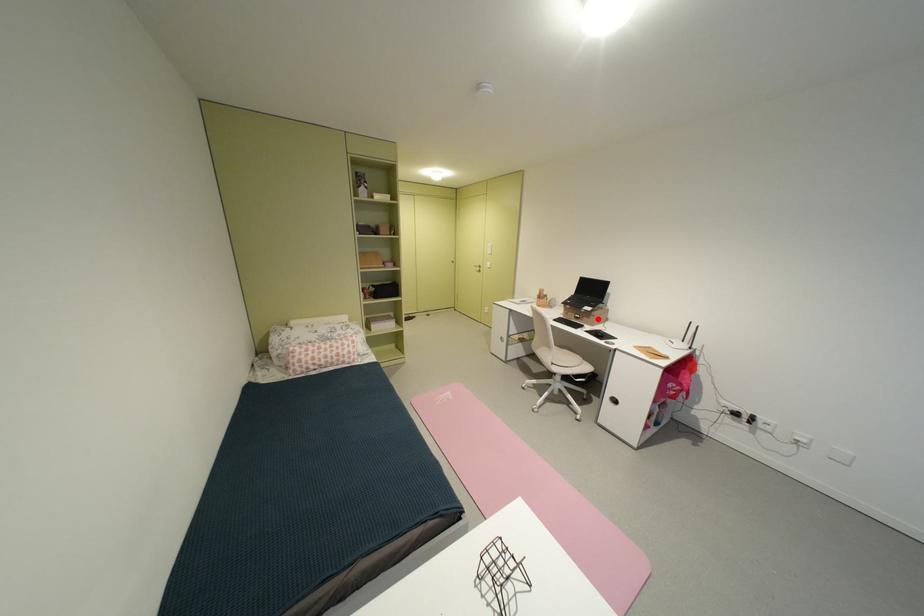
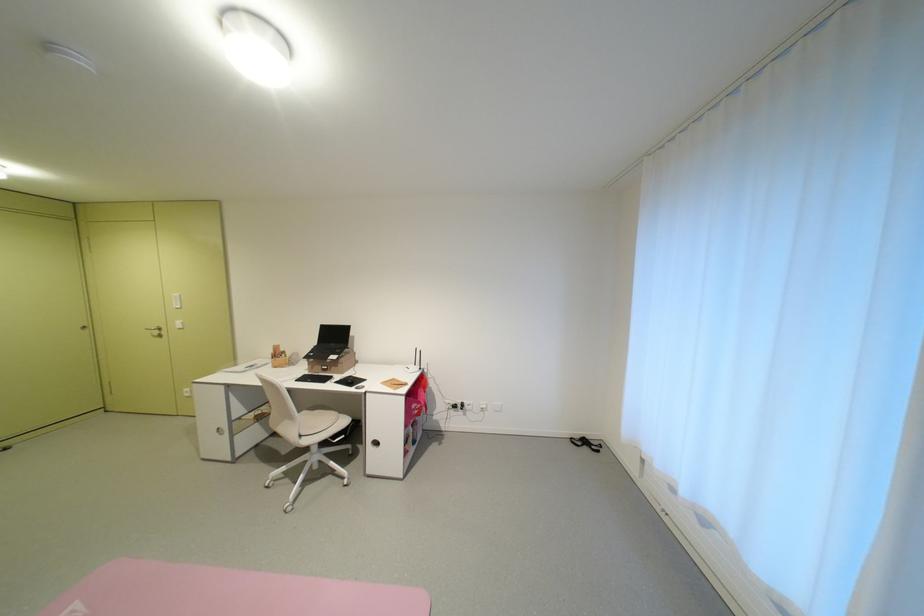
Where in the second image is the point corresponding to the highlighted location from the first image?

(346, 368)